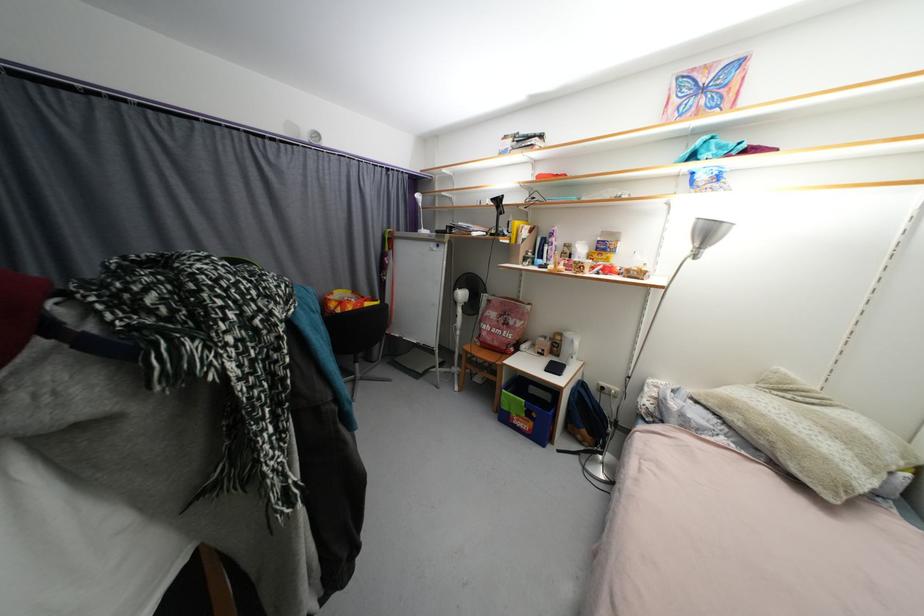
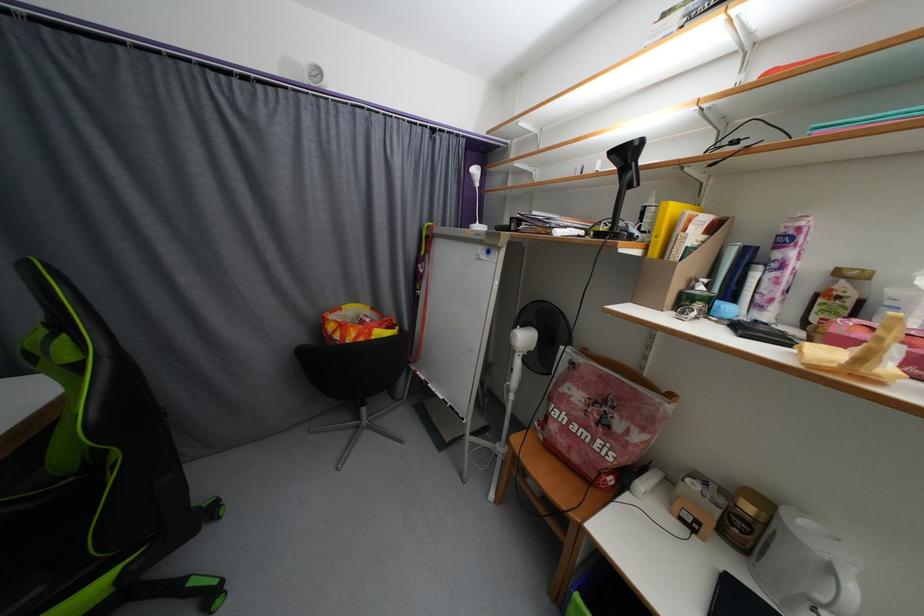
Question: What movement of the cameraman would produce the second image?

Choices:
 (A) Left
 (B) Right
 (C) Forward
 (D) Backward

Answer: (C)